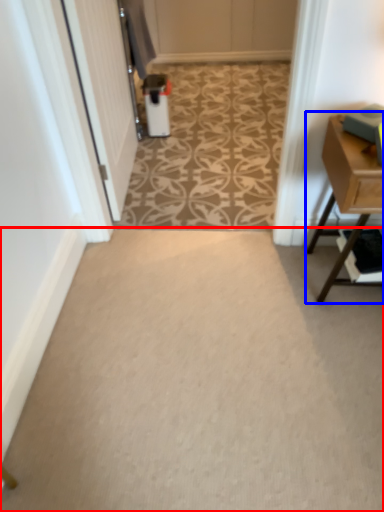
Question: Which of the following is the closest to the observer, plain (highlighted by a red box) or table (highlighted by a blue box)?

Choices:
 (A) plain
 (B) table

Answer: (A)